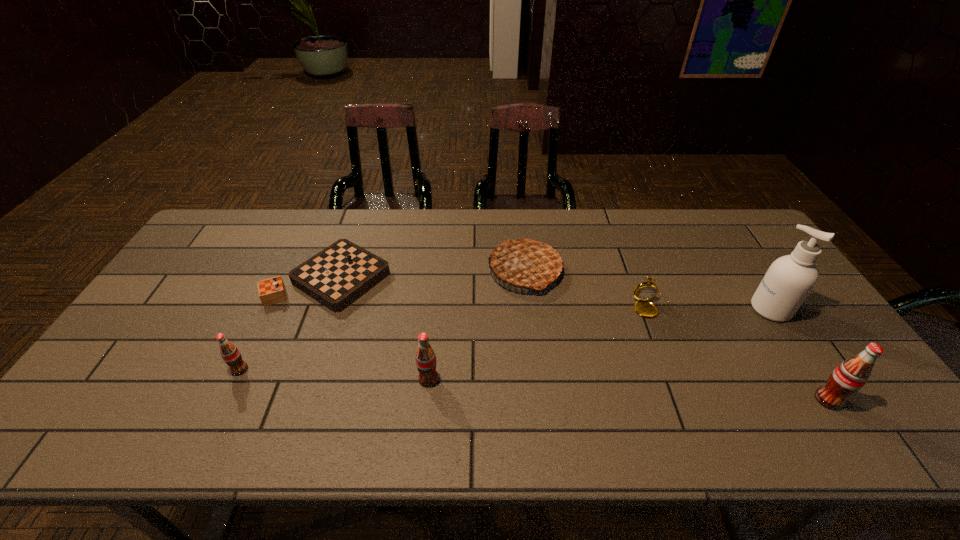
Image resolution: width=960 pixels, height=540 pixels. What are the coordinates of `spot to insert another pop_(soda) for uniform distribution` in the screenshot? It's located at (624, 389).